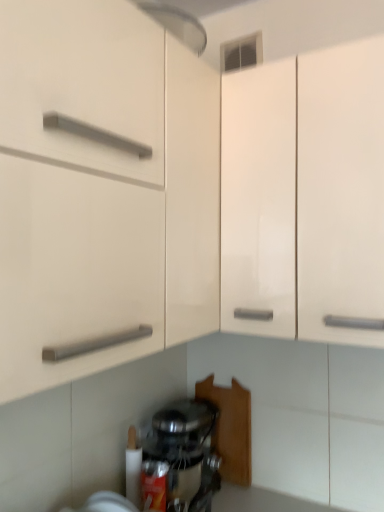
Where is `white glossy cabinet at center`? This screenshot has height=512, width=384. white glossy cabinet at center is located at coordinates coord(306,192).

Measure the distance between white glossy cabinet at center and camera.

white glossy cabinet at center and camera are 3.39 feet apart from each other.

What do you see at coordinates (306, 192) in the screenshot? The width and height of the screenshot is (384, 512). I see `white glossy cabinet at center` at bounding box center [306, 192].

You are a GUI agent. You are given a task and a screenshot of the screen. Output one action in this format:
    pyautogui.click(x=<x>, y=<y>)
    Task: Click on the satin silver mixer at lower center
    The height and width of the screenshot is (512, 384).
    Given the screenshot: What is the action you would take?
    pyautogui.click(x=186, y=452)

Measure the distance between satin silver mixer at lower center and camera.

satin silver mixer at lower center and camera are 1.24 meters apart.

The height and width of the screenshot is (512, 384). Describe the element at coordinates (186, 452) in the screenshot. I see `satin silver mixer at lower center` at that location.

In order to face satin silver mixer at lower center, should I rotate leftwards or rightwards?

To face it directly, rotate left by 0.477 degrees.

What is the approximate height of satin silver mixer at lower center?

It is 13.16 inches.

At what (x,y) coordinates should I click in order to perform the action: click on white glossy cabinet at center. Please return your answer as a coordinate pair (x, y). Image resolution: width=384 pixels, height=512 pixels. Looking at the image, I should click on (306, 192).

Does satin silver mixer at lower center appear on the left side of white glossy cabinet at center?

Yes.

Considering their positions, is satin silver mixer at lower center located in front of or behind white glossy cabinet at center?

In the image, satin silver mixer at lower center appears behind white glossy cabinet at center.

Does point (182, 436) lie in front of point (376, 311)?

That is False.

From the image's perspective, relative to white glossy cabinet at center, is satin silver mixer at lower center above or below?

satin silver mixer at lower center is below white glossy cabinet at center.

From a real-world perspective, which is physically below, satin silver mixer at lower center or white glossy cabinet at center?

In real-world perspective, satin silver mixer at lower center is lower.

Considering the sizes of objects satin silver mixer at lower center and white glossy cabinet at center in the image provided, who is thinner, satin silver mixer at lower center or white glossy cabinet at center?

white glossy cabinet at center.

In terms of height, does satin silver mixer at lower center look taller or shorter compared to white glossy cabinet at center?

Clearly, satin silver mixer at lower center is shorter compared to white glossy cabinet at center.

Between satin silver mixer at lower center and white glossy cabinet at center, which one has larger size?

white glossy cabinet at center is bigger.

Would you say satin silver mixer at lower center is inside or outside white glossy cabinet at center?

satin silver mixer at lower center is spatially situated outside white glossy cabinet at center.

Is satin silver mixer at lower center touching white glossy cabinet at center?

satin silver mixer at lower center and white glossy cabinet at center are clearly separated.

Is satin silver mixer at lower center oriented away from white glossy cabinet at center?

satin silver mixer at lower center is not turned away from white glossy cabinet at center.

How many degrees apart are the facing directions of satin silver mixer at lower center and white glossy cabinet at center?

There is a 3.65-degree angle between the facing directions of satin silver mixer at lower center and white glossy cabinet at center.

How distant is satin silver mixer at lower center from white glossy cabinet at center?

satin silver mixer at lower center and white glossy cabinet at center are 26.90 inches apart from each other.

The width and height of the screenshot is (384, 512). Identify the location of home appliance behind the white glossy cabinet at center. pyautogui.click(x=186, y=452).

Can you confirm if white glossy cabinet at center is positioned to the left of satin silver mixer at lower center?

No.

Which is behind, white glossy cabinet at center or satin silver mixer at lower center?

satin silver mixer at lower center is further from the camera.

Which is closer, (353, 256) or (191, 411)?

The point (353, 256) is closer to the camera.

From the image's perspective, between white glossy cabinet at center and satin silver mixer at lower center, who is located below?

satin silver mixer at lower center is shown below in the image.

From a real-world perspective, who is located higher, white glossy cabinet at center or satin silver mixer at lower center?

In real-world perspective, white glossy cabinet at center is above.

Is white glossy cabinet at center thinner than satin silver mixer at lower center?

Indeed, white glossy cabinet at center has a lesser width compared to satin silver mixer at lower center.

Is white glossy cabinet at center shorter than satin silver mixer at lower center?

No, white glossy cabinet at center is not shorter than satin silver mixer at lower center.

Is white glossy cabinet at center bigger or smaller than satin silver mixer at lower center?

In the image, white glossy cabinet at center appears to be larger than satin silver mixer at lower center.

Would you say white glossy cabinet at center contains satin silver mixer at lower center?

No, satin silver mixer at lower center is located outside of white glossy cabinet at center.

In the scene shown: Are white glossy cabinet at center and satin silver mixer at lower center beside each other?

They are not placed beside each other.

Could you tell me if white glossy cabinet at center is turned towards satin silver mixer at lower center?

No, white glossy cabinet at center is not oriented towards satin silver mixer at lower center.

How many degrees apart are the facing directions of white glossy cabinet at center and satin silver mixer at lower center?

Answer: white glossy cabinet at center and satin silver mixer at lower center are facing 3.65 degrees away from each other.

Measure the distance between white glossy cabinet at center and satin silver mixer at lower center.

white glossy cabinet at center is 26.90 inches from satin silver mixer at lower center.

Identify the location of home appliance below the white glossy cabinet at center (from the image's perspective). This screenshot has width=384, height=512. (186, 452).

Find the location of a particular element. cabinetry above the satin silver mixer at lower center (from a real-world perspective) is located at coordinates (306, 192).

You are a GUI agent. You are given a task and a screenshot of the screen. Output one action in this format:
    pyautogui.click(x=<x>, y=<y>)
    Task: Click on the home appliance located below the white glossy cabinet at center (from the image's perspective)
    
    Given the screenshot: What is the action you would take?
    (x=186, y=452)